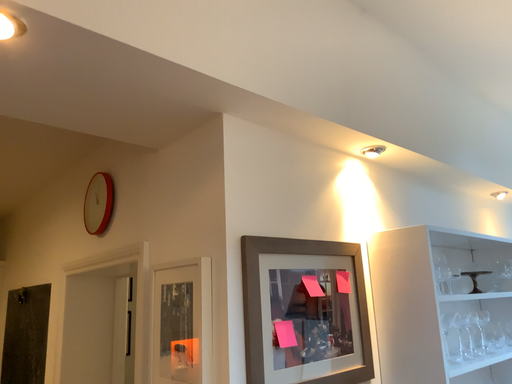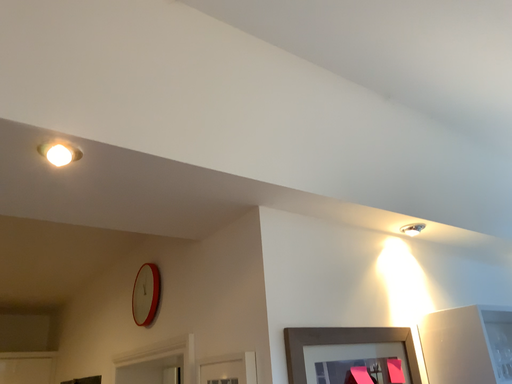
Question: Which way did the camera rotate in the video?

Choices:
 (A) rotated downward
 (B) rotated upward

Answer: (B)